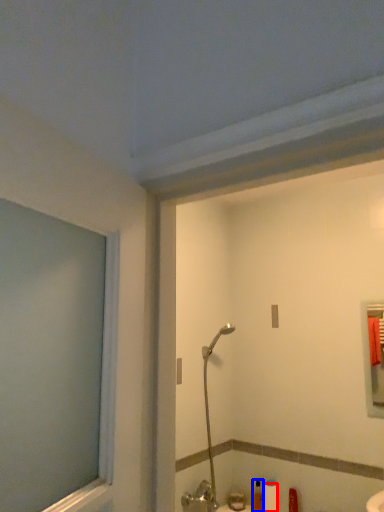
Question: Which point is closer to the camera, toilet paper (highlighted by a red box) or toiletry (highlighted by a blue box)?

Choices:
 (A) toilet paper
 (B) toiletry

Answer: (A)